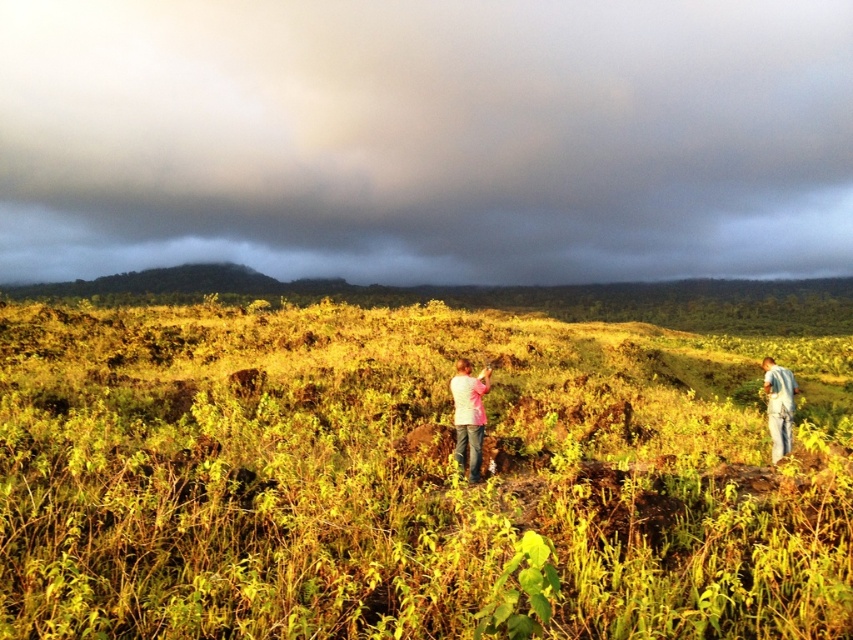
You are a photographer standing at the edge of the grassy terrain. You want to capture a photo that includes both the dark gray cloud at upper center and the pink fabric at center. Given that your camera has a maximum zoom range of 50 meters, will you be able to frame both objects in the same shot without moving closer?

The distance between the dark gray cloud at upper center and the pink fabric at center is 62.32 meters, which exceeds the camera maximum zoom range of 50 meters. Therefore, you cannot frame both objects in the same shot without moving closer.

You are a photographer planning to take a photo of the dark gray cloud at upper center and the blue jeans at lower right. Which object should you focus on first if you want to capture both in a single frame without moving the camera?

You should focus on the dark gray cloud at upper center first because it is wider than the blue jeans at lower right, allowing you to adjust the framing to include both objects more easily.